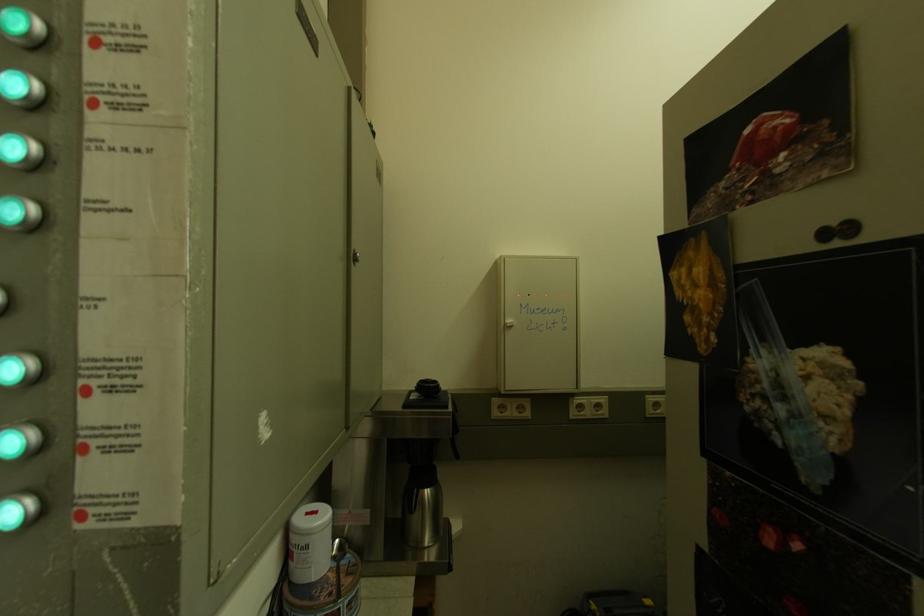
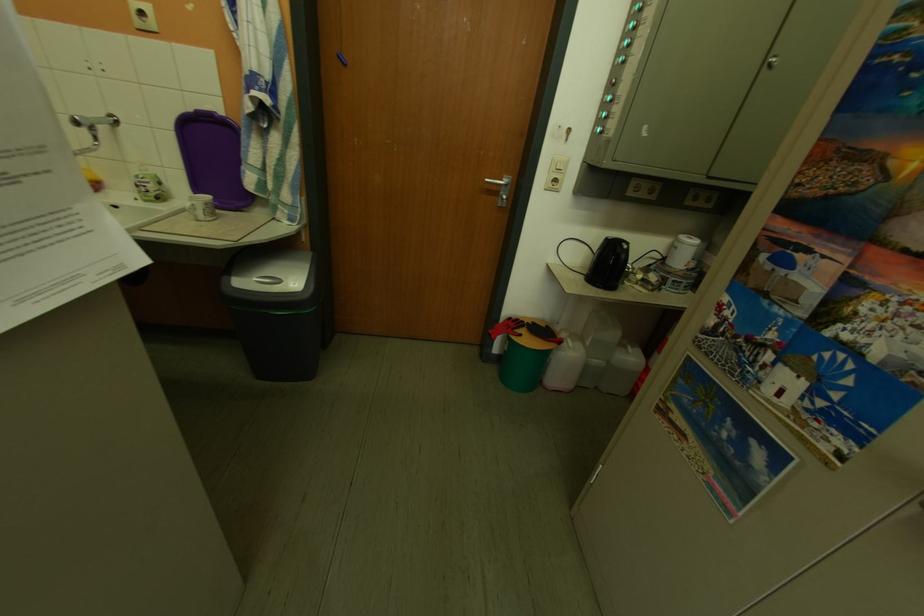
Find the pixel in the second image that matches [320,551] in the first image.

(689, 251)